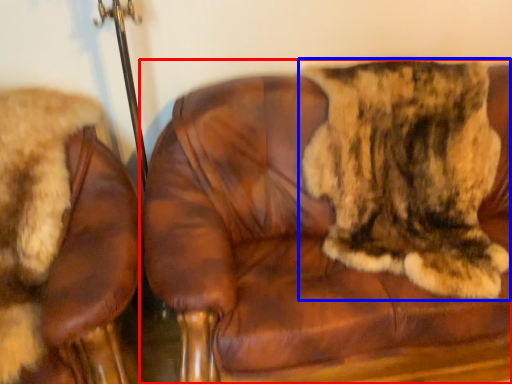
Question: Which object appears farthest to the camera in this image, chair (highlighted by a red box) or cat (highlighted by a blue box)?

Choices:
 (A) chair
 (B) cat

Answer: (B)